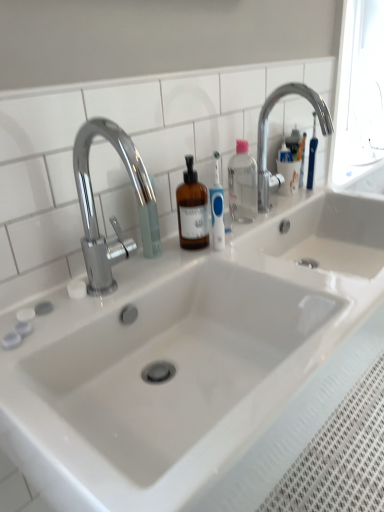
Question: Considering the relative sizes of chrome metallic faucet at upper right, which is counted as the 1th tap, starting from the back, and chrome metallic faucet at left, which is counted as the second tap, starting from the right, in the image provided, is chrome metallic faucet at upper right, which is counted as the 1th tap, starting from the back, smaller than chrome metallic faucet at left, which is counted as the second tap, starting from the right,?

Choices:
 (A) yes
 (B) no

Answer: (B)

Question: Is chrome metallic faucet at upper right, the 2th tap in the left-to-right sequence, not near chrome metallic faucet at left, the 1th tap from the front?

Choices:
 (A) yes
 (B) no

Answer: (B)

Question: Is chrome metallic faucet at upper right, the 2th tap in the left-to-right sequence, looking in the opposite direction of chrome metallic faucet at left, arranged as the 1th tap when viewed from the left?

Choices:
 (A) no
 (B) yes

Answer: (A)

Question: Does chrome metallic faucet at upper right, which is counted as the 1th tap, starting from the back, have a greater height compared to chrome metallic faucet at left, arranged as the 1th tap when viewed from the left?

Choices:
 (A) no
 (B) yes

Answer: (A)

Question: Does chrome metallic faucet at upper right, the 2th tap in the left-to-right sequence, appear on the left side of chrome metallic faucet at left, arranged as the 1th tap when viewed from the left?

Choices:
 (A) no
 (B) yes

Answer: (A)

Question: From a real-world perspective, is chrome metallic faucet at left, arranged as the 1th tap when viewed from the left, above or below chrome metallic faucet at upper right, the 2th tap in the left-to-right sequence?

Choices:
 (A) above
 (B) below

Answer: (B)

Question: Would you say chrome metallic faucet at left, arranged as the 1th tap when viewed from the left, is to the left or to the right of chrome metallic faucet at upper right, which is counted as the first tap, starting from the right, in the picture?

Choices:
 (A) right
 (B) left

Answer: (B)

Question: In terms of width, does chrome metallic faucet at left, which is counted as the second tap, starting from the right, look wider or thinner when compared to chrome metallic faucet at upper right, the 2th tap in the left-to-right sequence?

Choices:
 (A) thin
 (B) wide

Answer: (A)

Question: Considering the positions of chrome metallic faucet at left, acting as the 2th tap starting from the back, and chrome metallic faucet at upper right, the 2th tap in the left-to-right sequence, in the image, is chrome metallic faucet at left, acting as the 2th tap starting from the back, taller or shorter than chrome metallic faucet at upper right, the 2th tap in the left-to-right sequence,?

Choices:
 (A) short
 (B) tall

Answer: (B)

Question: Considering the relative positions of clear plastic bottle at center and chrome metallic faucet at left, the 1th tap from the front, in the image provided, is clear plastic bottle at center to the left or to the right of chrome metallic faucet at left, the 1th tap from the front,?

Choices:
 (A) right
 (B) left

Answer: (A)

Question: Relative to chrome metallic faucet at left, which is counted as the second tap, starting from the right, is clear plastic bottle at center in front or behind?

Choices:
 (A) front
 (B) behind

Answer: (B)

Question: Looking at their shapes, would you say clear plastic bottle at center is wider or thinner than chrome metallic faucet at left, arranged as the 1th tap when viewed from the left?

Choices:
 (A) thin
 (B) wide

Answer: (A)

Question: In terms of height, does clear plastic bottle at center look taller or shorter compared to chrome metallic faucet at left, arranged as the 1th tap when viewed from the left?

Choices:
 (A) short
 (B) tall

Answer: (A)

Question: Is chrome metallic faucet at left, arranged as the 1th tap when viewed from the left, inside or outside of clear plastic bottle at center?

Choices:
 (A) outside
 (B) inside

Answer: (A)

Question: Is point (148, 207) positioned closer to the camera than point (248, 161)?

Choices:
 (A) closer
 (B) farther

Answer: (A)